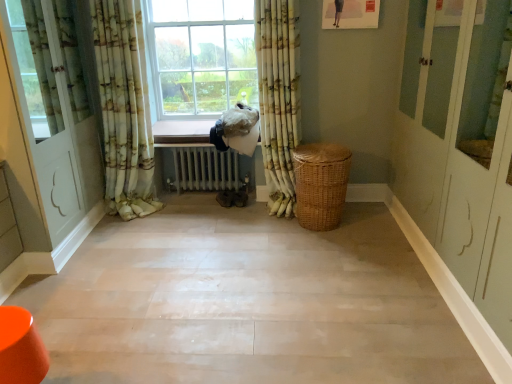
Question: From the image's perspective, would you say floral fabric curtain at left, which ranks as the first curtain in left-to-right order, is shown under metallic radiator at center?

Choices:
 (A) yes
 (B) no

Answer: (B)

Question: Does floral fabric curtain at left, which appears as the 2th curtain when viewed from the right, have a larger size compared to metallic radiator at center?

Choices:
 (A) yes
 (B) no

Answer: (A)

Question: Is floral fabric curtain at left, which ranks as the first curtain in left-to-right order, further to camera compared to metallic radiator at center?

Choices:
 (A) no
 (B) yes

Answer: (A)

Question: Is floral fabric curtain at left, which ranks as the first curtain in left-to-right order, not inside metallic radiator at center?

Choices:
 (A) no
 (B) yes

Answer: (B)

Question: Is smooth beige floor at center inside or outside of metallic radiator at center?

Choices:
 (A) inside
 (B) outside

Answer: (B)

Question: Looking at their shapes, would you say smooth beige floor at center is wider or thinner than metallic radiator at center?

Choices:
 (A) thin
 (B) wide

Answer: (B)

Question: Is smooth beige floor at center in front of or behind metallic radiator at center in the image?

Choices:
 (A) behind
 (B) front

Answer: (B)

Question: From a real-world perspective, is smooth beige floor at center physically located above or below metallic radiator at center?

Choices:
 (A) above
 (B) below

Answer: (B)

Question: From their relative heights in the image, would you say metallic radiator at center is taller or shorter than smooth beige floor at center?

Choices:
 (A) short
 (B) tall

Answer: (B)

Question: Relative to smooth beige floor at center, is metallic radiator at center in front or behind?

Choices:
 (A) behind
 (B) front

Answer: (A)

Question: From a real-world perspective, relative to smooth beige floor at center, is metallic radiator at center vertically above or below?

Choices:
 (A) above
 (B) below

Answer: (A)

Question: In the image, is metallic radiator at center on the left side or the right side of smooth beige floor at center?

Choices:
 (A) left
 (B) right

Answer: (A)

Question: Considering the relative positions of smooth beige floor at center and floral fabric curtain at left, which ranks as the first curtain in left-to-right order, in the image provided, is smooth beige floor at center to the left or to the right of floral fabric curtain at left, which ranks as the first curtain in left-to-right order,?

Choices:
 (A) left
 (B) right

Answer: (B)

Question: From the image's perspective, is smooth beige floor at center positioned above or below floral fabric curtain at left, which appears as the 2th curtain when viewed from the right?

Choices:
 (A) above
 (B) below

Answer: (B)